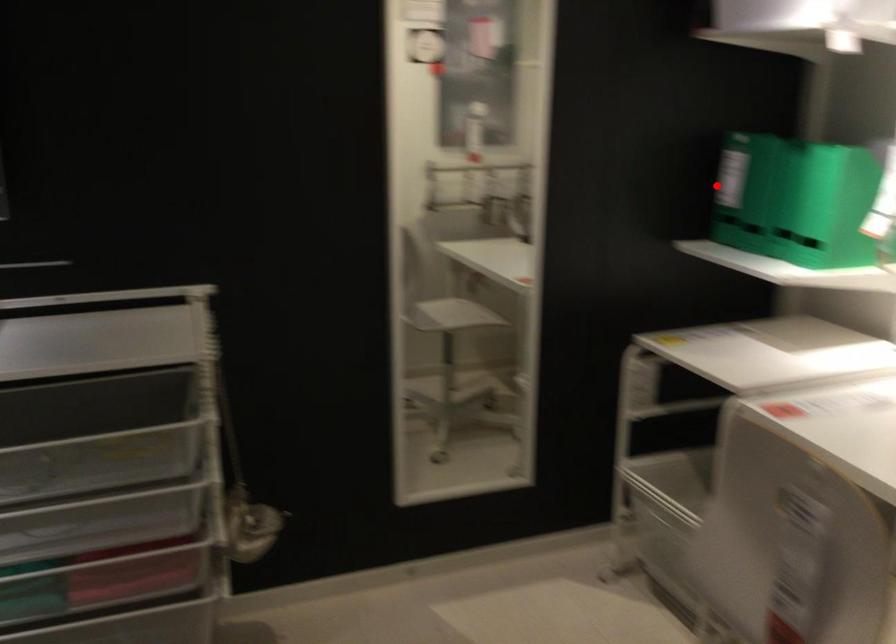
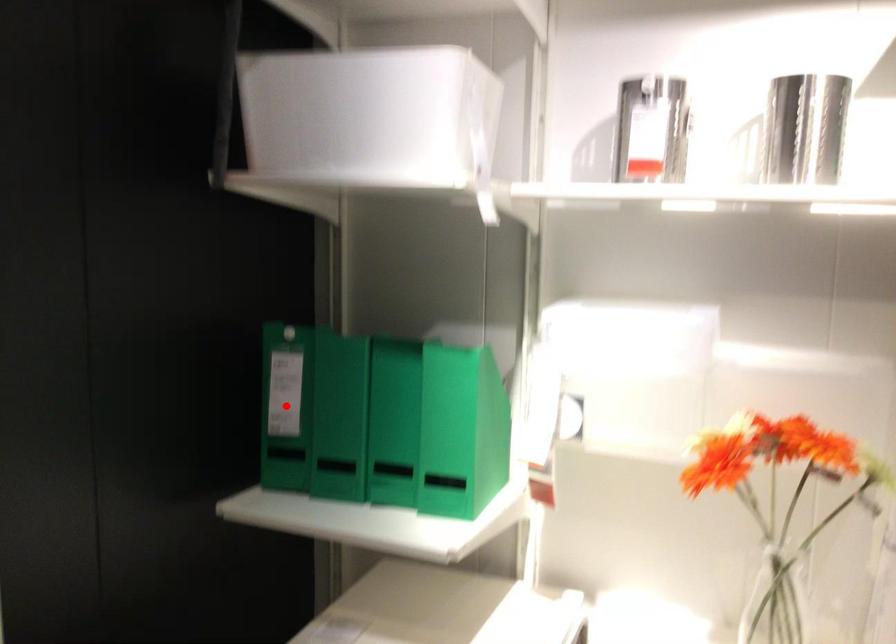
I am providing you with two images of the same scene from different viewpoints. A red point is marked on the first image and another point is marked on the second image. Is the marked point in image1 the same physical position as the marked point in image2?

Yes